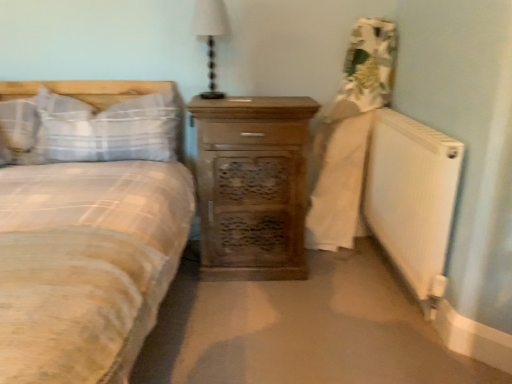
Image resolution: width=512 pixels, height=384 pixels. What do you see at coordinates (252, 186) in the screenshot? I see `wooden chest of drawers at center` at bounding box center [252, 186].

Find the location of `white fabric lampshade at upper center`. white fabric lampshade at upper center is located at coordinates (210, 36).

What do you see at coordinates (106, 129) in the screenshot?
I see `plaid fabric pillow at left, the first pillow from the right` at bounding box center [106, 129].

Image resolution: width=512 pixels, height=384 pixels. In order to click on white plaid pillow at left, arranged as the second pillow when viewed from the right in this screenshot , I will do `click(18, 131)`.

What do you see at coordinates (412, 199) in the screenshot? I see `white matte radiator at lower right` at bounding box center [412, 199].

At what (x,y) coordinates should I click in order to perform the action: click on wooden chest of drawers at center. Please return your answer as a coordinate pair (x, y). The height and width of the screenshot is (384, 512). Looking at the image, I should click on (252, 186).

Is wooden chest of drawers at center thinner than white plaid pillow at left, arranged as the second pillow when viewed from the right?

In fact, wooden chest of drawers at center might be wider than white plaid pillow at left, arranged as the second pillow when viewed from the right.

Is wooden chest of drawers at center to the left of white plaid pillow at left, arranged as the second pillow when viewed from the right, from the viewer's perspective?

No.

Which object is closer to the camera, wooden chest of drawers at center or white plaid pillow at left, which appears as the first pillow when viewed from the left?

white plaid pillow at left, which appears as the first pillow when viewed from the left, is more forward.

Identify the location of the 1st pillow in front when counting from the white fabric lampshade at upper center. This screenshot has height=384, width=512. (18, 131).

Is white plaid pillow at left, which appears as the first pillow when viewed from the left, inside the boundaries of white fabric lampshade at upper center, or outside?

white plaid pillow at left, which appears as the first pillow when viewed from the left, cannot be found inside white fabric lampshade at upper center.

Would you say white plaid pillow at left, arranged as the second pillow when viewed from the right, is to the left or to the right of white fabric lampshade at upper center in the picture?

white plaid pillow at left, arranged as the second pillow when viewed from the right, is to the left of white fabric lampshade at upper center.

Is white plaid pillow at left, which appears as the first pillow when viewed from the left, turned away from white fabric lampshade at upper center?

No, white plaid pillow at left, which appears as the first pillow when viewed from the left,'s orientation is not away from white fabric lampshade at upper center.

Is plaid fabric pillow at left, which is the second pillow in left-to-right order, closer to the viewer compared to white matte radiator at lower right?

No, it is behind white matte radiator at lower right.

From the image's perspective, which is below, plaid fabric pillow at left, the first pillow from the right, or white matte radiator at lower right?

white matte radiator at lower right.

Is point (89, 111) in front of point (435, 260)?

No.

From a real-world perspective, does plaid fabric pillow at left, the first pillow from the right, stand above white matte radiator at lower right?

Yes.

Which is behind, point (220, 13) or point (169, 144)?

Point (220, 13)

Considering the sizes of white fabric lampshade at upper center and plaid fabric pillow at left, which is the second pillow in left-to-right order, in the image, is white fabric lampshade at upper center taller or shorter than plaid fabric pillow at left, which is the second pillow in left-to-right order,?

In the image, white fabric lampshade at upper center appears to be taller than plaid fabric pillow at left, which is the second pillow in left-to-right order.

Where is `pillow that is the 1st one below the white fabric lampshade at upper center (from a real-world perspective)`? This screenshot has width=512, height=384. pillow that is the 1st one below the white fabric lampshade at upper center (from a real-world perspective) is located at coordinates (106, 129).

From a real-world perspective, is white fabric lampshade at upper center below plaid fabric pillow at left, the first pillow from the right?

No, from a real-world perspective, white fabric lampshade at upper center is not under plaid fabric pillow at left, the first pillow from the right.

Which is closer to the camera, (x=68, y=142) or (x=206, y=182)?

Point (x=68, y=142) is closer to the camera than point (x=206, y=182).

From the picture: Is plaid fabric pillow at left, which is the second pillow in left-to-right order, in contact with wooden chest of drawers at center?

No.

Which object is thinner, plaid fabric pillow at left, which is the second pillow in left-to-right order, or wooden chest of drawers at center?

With smaller width is plaid fabric pillow at left, which is the second pillow in left-to-right order.

Considering the positions of objects plaid fabric pillow at left, which is the second pillow in left-to-right order, and wooden chest of drawers at center in the image provided, who is more to the right, plaid fabric pillow at left, which is the second pillow in left-to-right order, or wooden chest of drawers at center?

wooden chest of drawers at center is more to the right.

Is white matte radiator at lower right located outside white fabric lampshade at upper center?

white matte radiator at lower right lies outside white fabric lampshade at upper center's area.

Which object is closer to the camera, white matte radiator at lower right or white fabric lampshade at upper center?

white matte radiator at lower right.

Does white matte radiator at lower right have a lesser width compared to white fabric lampshade at upper center?

Indeed, white matte radiator at lower right has a lesser width compared to white fabric lampshade at upper center.

From the image's perspective, relative to white fabric lampshade at upper center, is white matte radiator at lower right above or below?

white matte radiator at lower right is situated lower than white fabric lampshade at upper center in the image.

Can you confirm if white plaid pillow at left, which appears as the first pillow when viewed from the left, is positioned to the right of white matte radiator at lower right?

In fact, white plaid pillow at left, which appears as the first pillow when viewed from the left, is to the left of white matte radiator at lower right.

From a real-world perspective, between white plaid pillow at left, which appears as the first pillow when viewed from the left, and white matte radiator at lower right, who is vertically lower?

white matte radiator at lower right.

Locate an element on the screen. The width and height of the screenshot is (512, 384). radiator located on the right of white plaid pillow at left, which appears as the first pillow when viewed from the left is located at coordinates (412, 199).

Looking at this image, from the image's perspective, which object appears higher, white plaid pillow at left, which appears as the first pillow when viewed from the left, or white matte radiator at lower right?

white plaid pillow at left, which appears as the first pillow when viewed from the left, appears higher in the image.

Find the location of `the chest of drawers directly beneath the white plaid pillow at left, which appears as the first pillow when viewed from the left (from a real-world perspective)`. the chest of drawers directly beneath the white plaid pillow at left, which appears as the first pillow when viewed from the left (from a real-world perspective) is located at coordinates (252, 186).

Find the location of a particular element. the 2nd pillow counting from the left of the white fabric lampshade at upper center is located at coordinates (18, 131).

From the image, which object appears to be farther from wooden chest of drawers at center, white plaid pillow at left, arranged as the second pillow when viewed from the right, or plaid fabric pillow at left, which is the second pillow in left-to-right order?

white plaid pillow at left, arranged as the second pillow when viewed from the right, is positioned further to the anchor wooden chest of drawers at center.

When comparing their distances from wooden chest of drawers at center, does plaid fabric pillow at left, the first pillow from the right, or white fabric lampshade at upper center seem further?

white fabric lampshade at upper center lies further to wooden chest of drawers at center than the other object.

Based on their spatial positions, is white fabric lampshade at upper center or white plaid pillow at left, which appears as the first pillow when viewed from the left, closer to white matte radiator at lower right?

white fabric lampshade at upper center.

From the image, which object appears to be farther from white matte radiator at lower right, white plaid pillow at left, which appears as the first pillow when viewed from the left, or wooden chest of drawers at center?

Based on the image, white plaid pillow at left, which appears as the first pillow when viewed from the left, appears to be further to white matte radiator at lower right.

Based on their spatial positions, is plaid fabric pillow at left, the first pillow from the right, or wooden chest of drawers at center closer to white matte radiator at lower right?

Based on the image, wooden chest of drawers at center appears to be nearer to white matte radiator at lower right.

When comparing their distances from white plaid pillow at left, arranged as the second pillow when viewed from the right, does white fabric lampshade at upper center or plaid fabric pillow at left, which is the second pillow in left-to-right order, seem further?

white fabric lampshade at upper center.

Which object lies further to the anchor point wooden chest of drawers at center, white fabric lampshade at upper center or plaid fabric pillow at left, which is the second pillow in left-to-right order?

white fabric lampshade at upper center is positioned further to the anchor wooden chest of drawers at center.

Which object lies further to the anchor point white matte radiator at lower right, wooden chest of drawers at center or plaid fabric pillow at left, which is the second pillow in left-to-right order?

plaid fabric pillow at left, which is the second pillow in left-to-right order, is positioned further to the anchor white matte radiator at lower right.

Identify the location of bedside lamp between plaid fabric pillow at left, which is the second pillow in left-to-right order, and white matte radiator at lower right. (210, 36).

In order to click on pillow between white plaid pillow at left, arranged as the second pillow when viewed from the right, and white fabric lampshade at upper center, in the horizontal direction in this screenshot , I will do `click(106, 129)`.

Image resolution: width=512 pixels, height=384 pixels. In order to click on bedside lamp between white plaid pillow at left, arranged as the second pillow when viewed from the right, and wooden chest of drawers at center, in the horizontal direction in this screenshot , I will do `click(210, 36)`.

Locate an element on the screen. pillow between white plaid pillow at left, which appears as the first pillow when viewed from the left, and wooden chest of drawers at center is located at coordinates click(106, 129).